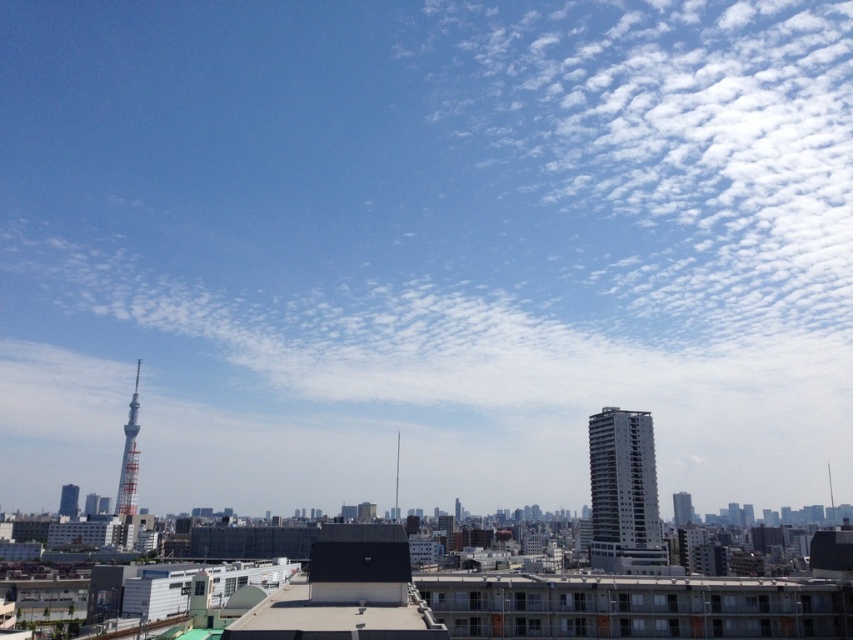
Based on the photo, you are an architect designing a new skyscraper that needs to comply with the city height regulations. You observe the white fluffy cloud at upper right and the metallic silver tower at left in the cityscape. Which object is taller and must be considered for compliance?

The white fluffy cloud at upper right has a greater height compared to the metallic silver tower at left, so it must be considered for compliance.

You are standing in the cityscape and want to take a photo of both the point at coordinates point (589, 273) and point (114, 512). Which point will appear closer to the camera in the photo?

Point (114, 512) will appear closer to the camera in the photo because it is physically closer to the camera than point (589, 273), which is further away.

You are a city planner analyzing the skyline. You need to determine which structure is taller between the white concrete building at right and the metallic silver tower at left. Based on the provided scene, which one is taller?

The metallic silver tower at left is taller than the white concrete building at right.